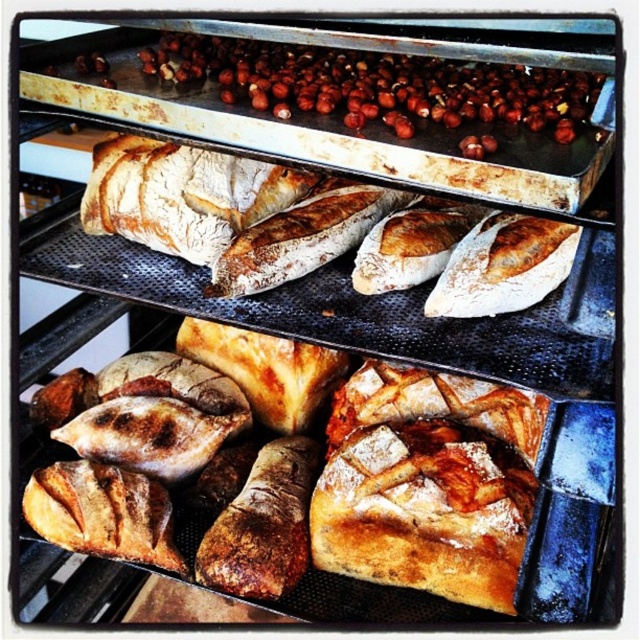
Question: Which of the following is the closest to the observer?

Choices:
 (A) 186,99
 (B) 148,154

Answer: (A)

Question: In this image, where is slightly golden crusty baguette at center located relative to brown matte nuts at upper center?

Choices:
 (A) above
 (B) below

Answer: (B)

Question: Which point is farther to the camera?

Choices:
 (A) (76, 68)
 (B) (481, 257)

Answer: (A)

Question: Among these objects, which one is nearest to the camera?

Choices:
 (A) brown matte nuts at upper center
 (B) slightly golden crusty baguette at center

Answer: (A)

Question: Can you confirm if slightly golden crusty baguette at center is positioned below brown matte nuts at upper center?

Choices:
 (A) yes
 (B) no

Answer: (A)

Question: Can you confirm if slightly golden crusty baguette at center is positioned below brown matte nuts at upper center?

Choices:
 (A) no
 (B) yes

Answer: (B)